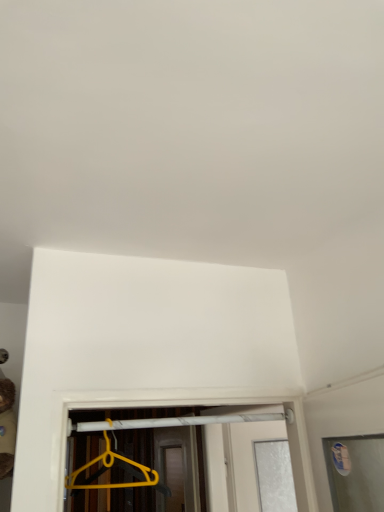
Question: Should I look upward or downward to see yellow plastic hanger at lower center?

Choices:
 (A) up
 (B) down

Answer: (B)